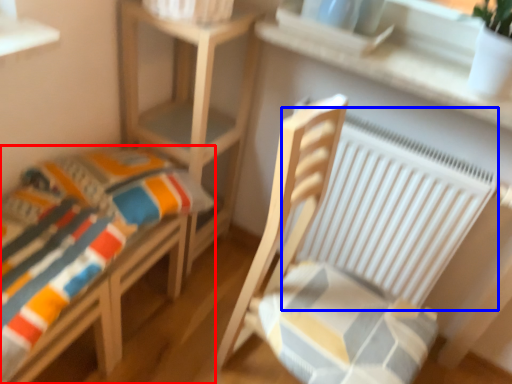
Question: Among these objects, which one is nearest to the camera, furniture (highlighted by a red box) or radiator (highlighted by a blue box)?

Choices:
 (A) furniture
 (B) radiator

Answer: (A)